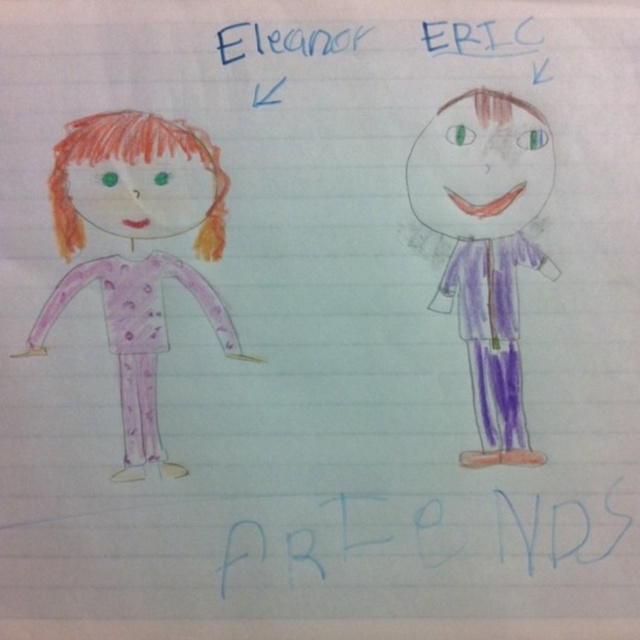
You are organizing a craft project and need to stack the blue paper at center and the purple paper doll at right. Which object should you place at the bottom to ensure stability?

The blue paper at center should be placed at the bottom because it has a lesser height compared to the purple paper doll at right, providing a stable base.

In the scene shown: You are organizing a craft project and need to place the blue paper at center and the purple paper doll at right. According to the drawing, which object should you place first to ensure proper layering?

The blue paper at center should be placed first because the purple paper doll at right is behind it, so it needs to be positioned over the blue paper at center to maintain the correct layering.

You are a parent checking your childs drawing. You notice a point at coordinates (x=138, y=180). What is located there?

At point (x=138, y=180) lies matte pink pajamas at left.